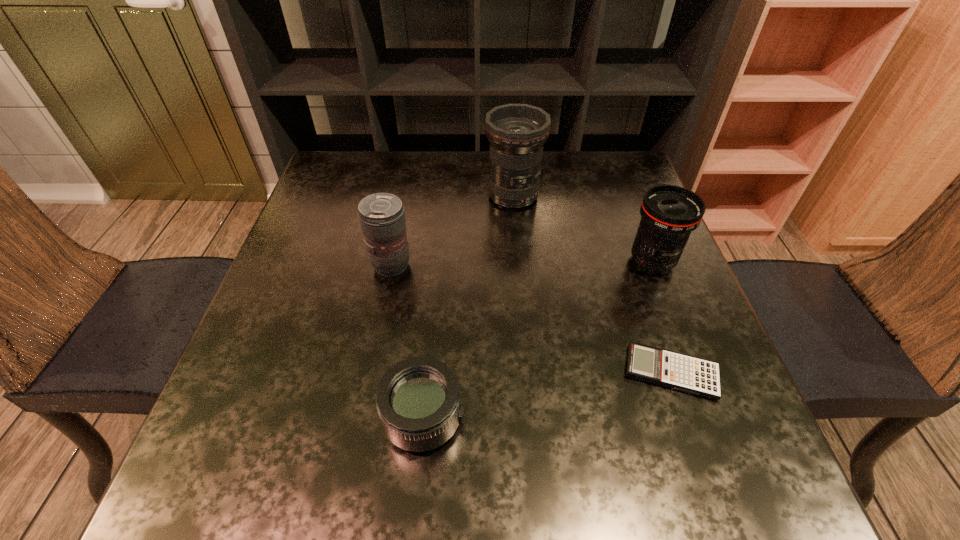
In the image, there is a desktop. Where is `vacant space at the far right corner`? vacant space at the far right corner is located at coordinates (595, 179).

Find the location of a particular element. This screenshot has height=540, width=960. blank region between the rightmost telephoto lens and the shortest telephoto lens is located at coordinates click(538, 340).

Locate an element on the screen. The height and width of the screenshot is (540, 960). free spot between the rightmost telephoto lens and the shortest object is located at coordinates (661, 317).

Find the location of a particular element. The width and height of the screenshot is (960, 540). vacant area that lies between the rightmost telephoto lens and the calculator is located at coordinates (661, 317).

At what (x,y) coordinates should I click in order to perform the action: click on vacant point located between the nearest telephoto lens and the rightmost telephoto lens. Please return your answer as a coordinate pair (x, y). This screenshot has height=540, width=960. Looking at the image, I should click on coord(538,340).

Find the location of a particular element. The height and width of the screenshot is (540, 960). free space between the rightmost telephoto lens and the shortest telephoto lens is located at coordinates (538, 340).

Locate an element on the screen. This screenshot has height=540, width=960. free area in between the calculator and the tallest telephoto lens is located at coordinates tap(592, 284).

Find the location of `free point between the rightmost telephoto lens and the calculator`. free point between the rightmost telephoto lens and the calculator is located at coordinates (661, 317).

In order to click on the third closest object to the tallest object in this screenshot , I will do `click(696, 376)`.

This screenshot has height=540, width=960. Identify the location of object that stands as the closest to the second shortest object. (382, 218).